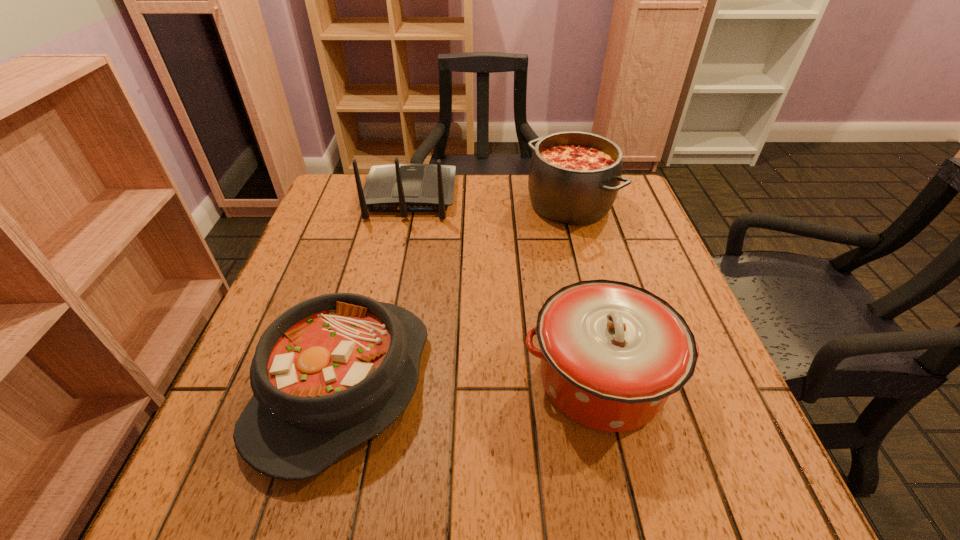
At what (x,y) coordinates should I click in order to perform the action: click on casserole located at the left edge. Please return your answer as a coordinate pair (x, y). The height and width of the screenshot is (540, 960). Looking at the image, I should click on (330, 373).

You are a GUI agent. You are given a task and a screenshot of the screen. Output one action in this format:
    pyautogui.click(x=<x>, y=<y>)
    Task: Click on the object that is at the far left corner
    The width and height of the screenshot is (960, 540).
    Given the screenshot: What is the action you would take?
    pyautogui.click(x=403, y=188)

Locate an element on the screen. object positioned at the near left corner is located at coordinates (330, 373).

The width and height of the screenshot is (960, 540). I want to click on object that is at the far right corner, so click(x=574, y=177).

Image resolution: width=960 pixels, height=540 pixels. In the image, there is a desktop. In order to click on vacant area at the far edge in this screenshot , I will do `click(540, 216)`.

This screenshot has height=540, width=960. In the image, there is a desktop. Identify the location of free space at the left edge. (304, 245).

In the image, there is a desktop. Where is `vacant space at the right edge`? This screenshot has height=540, width=960. vacant space at the right edge is located at coordinates (702, 425).

I want to click on blank area at the far left corner, so click(x=364, y=180).

The height and width of the screenshot is (540, 960). Find the location of `blank space at the far right corner of the desktop`. blank space at the far right corner of the desktop is located at coordinates (618, 192).

I want to click on vacant space that's between the router and the farthest casserole, so click(490, 200).